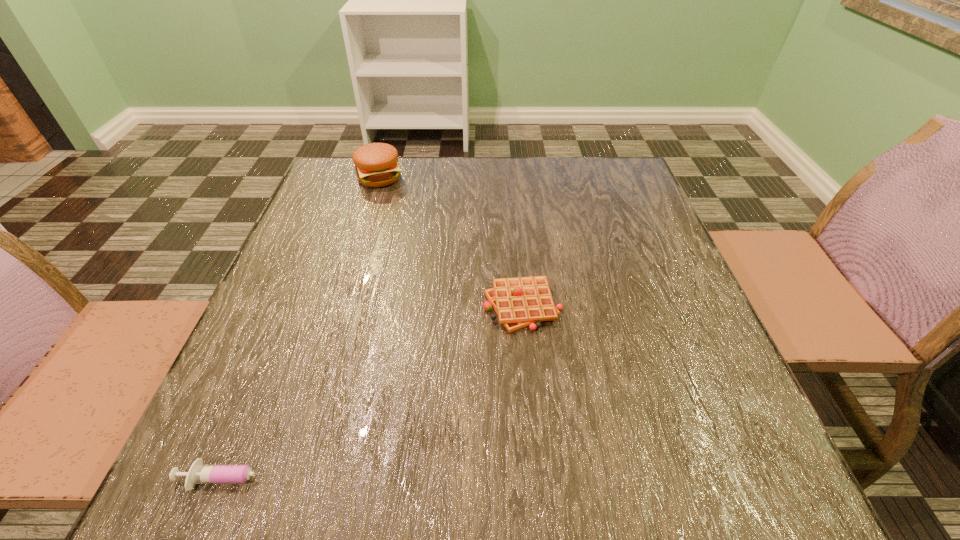
Locate an element on the screen. free region at the far right corner of the desktop is located at coordinates (601, 185).

Image resolution: width=960 pixels, height=540 pixels. In the image, there is a desktop. Identify the location of vacant space at the near right corner. (704, 506).

This screenshot has width=960, height=540. I want to click on vacant space in between the nearest object and the second farthest object, so click(x=380, y=392).

This screenshot has width=960, height=540. In order to click on free space between the farthest object and the second shortest object in this screenshot , I will do `click(451, 241)`.

Locate an element on the screen. Image resolution: width=960 pixels, height=540 pixels. vacant area that lies between the hamburger and the second shortest object is located at coordinates (451, 241).

I want to click on free point between the tallest object and the waffle, so click(451, 241).

At what (x,y) coordinates should I click in order to perform the action: click on blank region between the hamburger and the rightmost object. Please return your answer as a coordinate pair (x, y). Image resolution: width=960 pixels, height=540 pixels. Looking at the image, I should click on (451, 241).

Locate an element on the screen. The height and width of the screenshot is (540, 960). free space between the tallest object and the second nearest object is located at coordinates (451, 241).

Identify the location of free space between the waffle and the tallest object. This screenshot has height=540, width=960. (451, 241).

At what (x,y) coordinates should I click in order to perform the action: click on empty space between the second farthest object and the nearest object. Please return your answer as a coordinate pair (x, y). The image size is (960, 540). Looking at the image, I should click on (380, 392).